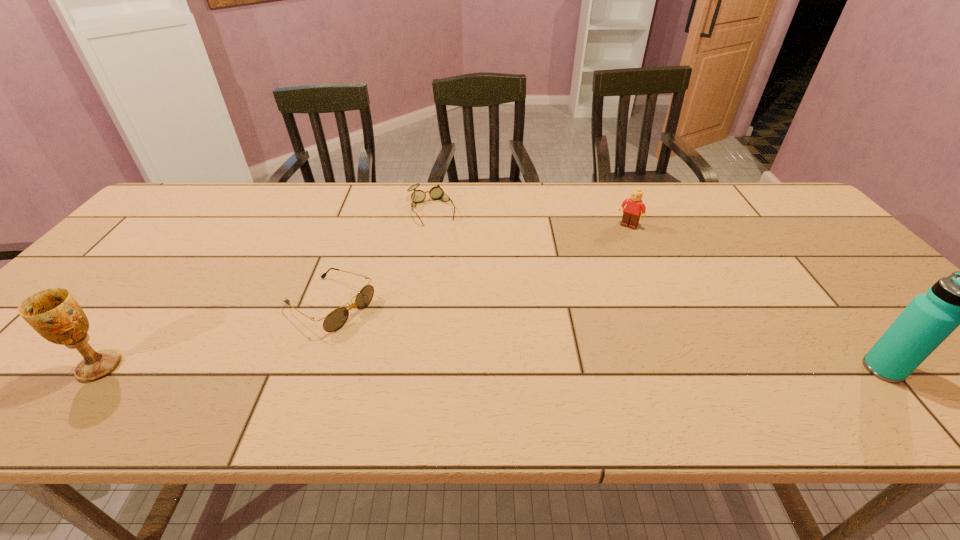
This screenshot has height=540, width=960. Identify the location of free space located 0.310m on the front-facing side of the third object from right to left. click(x=468, y=292).

The height and width of the screenshot is (540, 960). I want to click on Lego that is positioned at the far edge, so click(634, 206).

Where is `spectacles present at the far edge`? The width and height of the screenshot is (960, 540). spectacles present at the far edge is located at coordinates (418, 196).

I want to click on chalice that is positioned at the near edge, so click(x=53, y=313).

At what (x,y) coordinates should I click in order to perform the action: click on water bottle that is at the near edge. Please return your answer as a coordinate pair (x, y). Looking at the image, I should click on (959, 299).

This screenshot has width=960, height=540. I want to click on object that is at the right edge, so click(x=959, y=299).

What are the coordinates of `object located at the near right corner` in the screenshot? It's located at (959, 299).

Locate an element on the screen. vacant space at the far edge of the desktop is located at coordinates (328, 192).

The width and height of the screenshot is (960, 540). What are the coordinates of `vacant area at the near edge` in the screenshot? It's located at (386, 363).

This screenshot has height=540, width=960. Identify the location of free space at the left edge of the desktop. (150, 251).